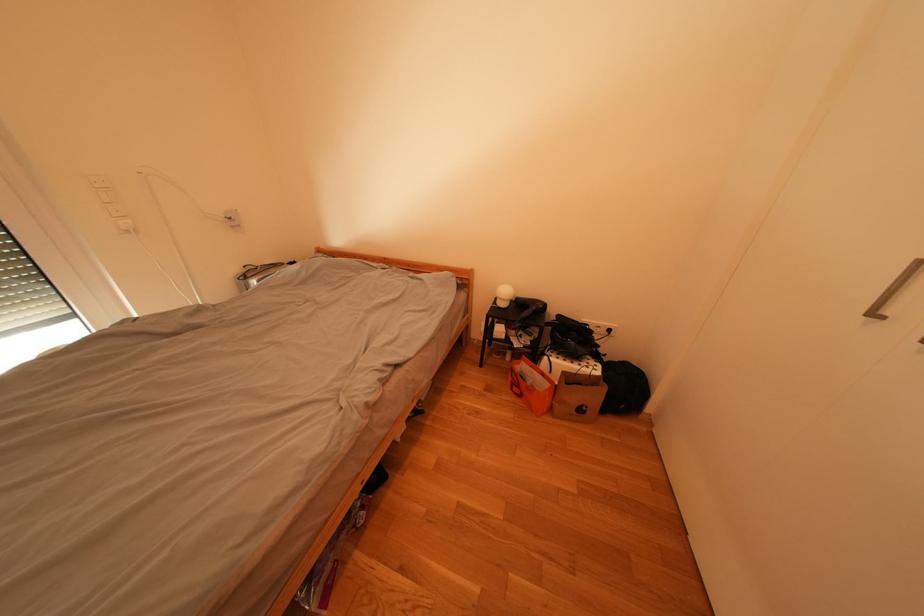
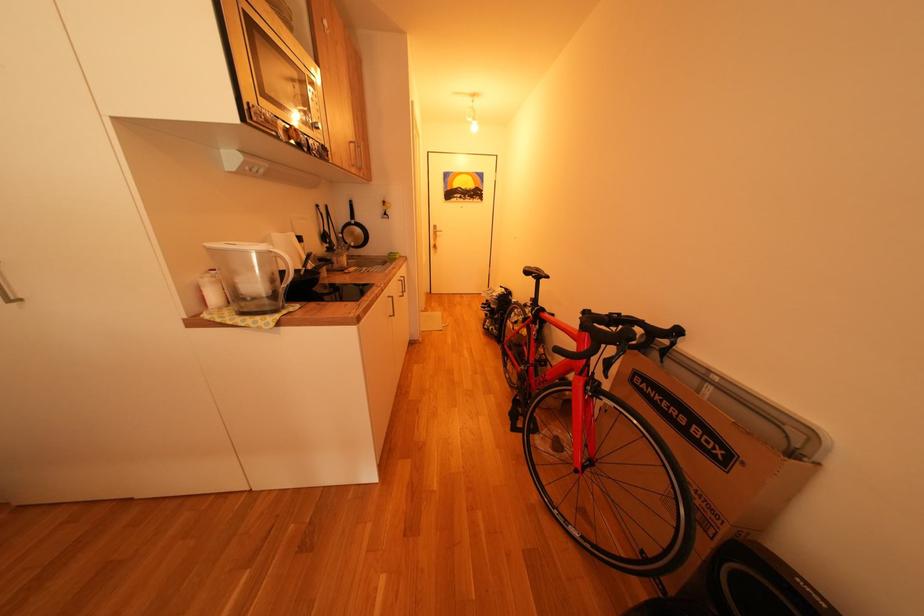
The first image is from the beginning of the video and the second image is from the end. How did the camera likely rotate when shooting the video?

The camera rotated toward right-down.